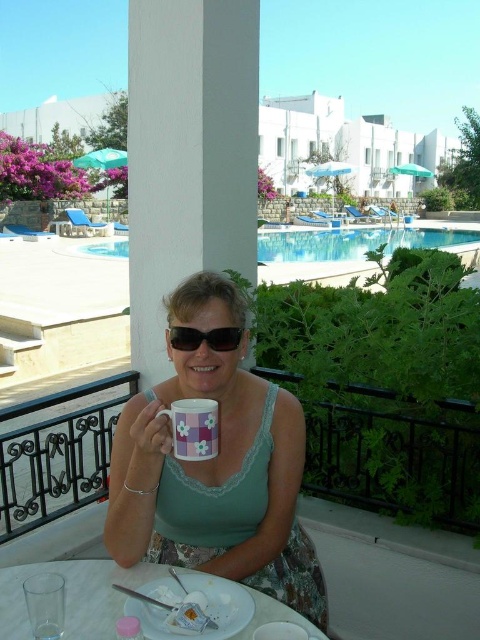
Consider the image. You are a waiter at this resort and need to place a new menu between the white glossy plate at lower center and the pastel floral mug at center. Based on their heights, which object should you place the menu closer to?

Since the white glossy plate at lower center is not as tall as the pastel floral mug at center, you should place the menu closer to the pastel floral mug at center to avoid it being obscured by the taller mug.

You are a hotel guest who wants to place a new vase on the table. The vase is taller than the pink floral mug at center. Where should you place the vase so it doesn not block the light from the white smooth pillar at center?

Place the vase to the side of the pink floral mug at center so it doesn not block the light from the white smooth pillar at center since the pink floral mug at center is currently positioned under the pillar.